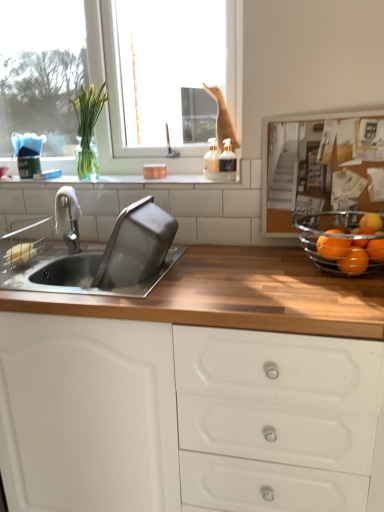
Locate an element on the screen. The height and width of the screenshot is (512, 384). vacant region to the left of clear glass bowl at right is located at coordinates (253, 274).